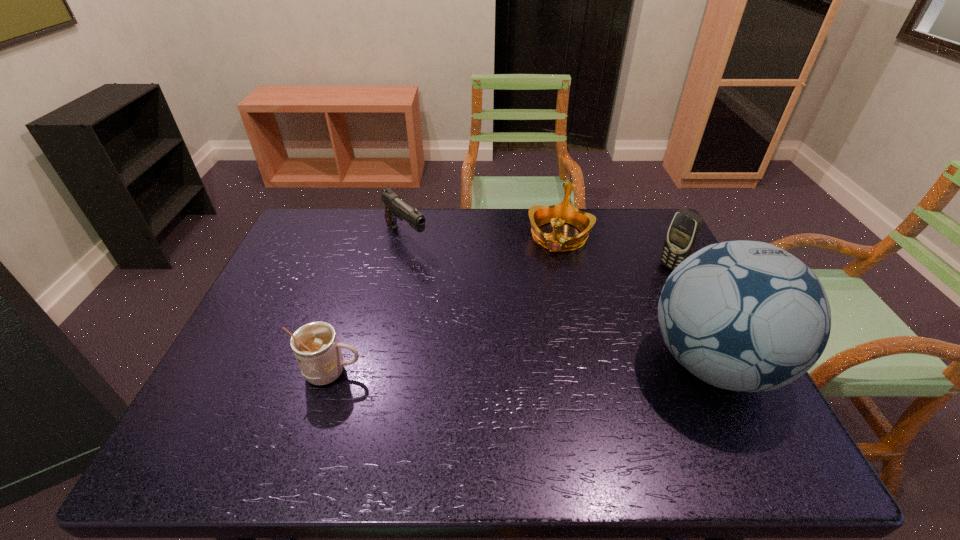
This screenshot has height=540, width=960. I want to click on cup, so click(315, 345).

Identify the location of the tallest object. The height and width of the screenshot is (540, 960). (747, 316).

Image resolution: width=960 pixels, height=540 pixels. What are the coordinates of `the fourth shortest object` in the screenshot? It's located at (683, 234).

Find the location of a particular element. gun is located at coordinates (395, 208).

Identify the location of tiara. Image resolution: width=960 pixels, height=540 pixels. (539, 215).

Identify the location of vacant region located on the side with the handle of the cup. This screenshot has width=960, height=540. (509, 373).

Where is `vacant position located 0.120m on the front face of the cellular telephone`? The height and width of the screenshot is (540, 960). vacant position located 0.120m on the front face of the cellular telephone is located at coordinates (637, 289).

Locate an element on the screen. free space located on the front face of the cellular telephone is located at coordinates (652, 281).

You are a GUI agent. You are given a task and a screenshot of the screen. Output one action in this format:
    pyautogui.click(x=<x>, y=<y>)
    Task: Click on the vacant space located 0.360m on the front face of the cellular telephone
    The height and width of the screenshot is (540, 960).
    Given the screenshot: What is the action you would take?
    pyautogui.click(x=576, y=328)

The height and width of the screenshot is (540, 960). I want to click on vacant point located 0.200m in the direction the gun is aimed, so click(458, 285).